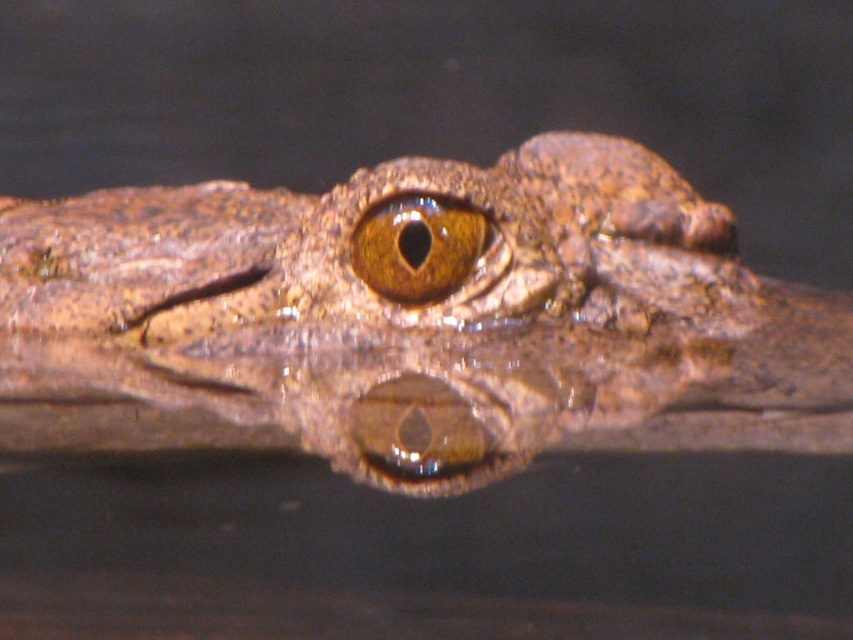
You are a wildlife photographer trying to capture a closeup of the brown scaly crocodile at center and the brown matte eye at center. Which object should you focus on first if you want to ensure both are in frame but prioritize the larger one?

The brown scaly crocodile at center is larger in size than the brown matte eye at center, so you should focus on the brown scaly crocodile at center first to ensure it fits in the frame while still capturing the brown matte eye at center.

You are a wildlife photographer aiming to capture the crocodile eye in the center. Given that the crocodile is at point 0.503, 0.485, can you determine if the brown scaly crocodile at center is positioned correctly for a clear eye shot?

The brown scaly crocodile at center is located at point (x=413, y=321), so the eye is centered and positioned correctly for a clear shot.

You are observing a crocodile head close up. There are two points marked on its head at coordinates point (560, 269) and point (370, 234). From your perspective, which point is closer to you?

Point (370, 234) is closer to you because it is in front of point (560, 269).